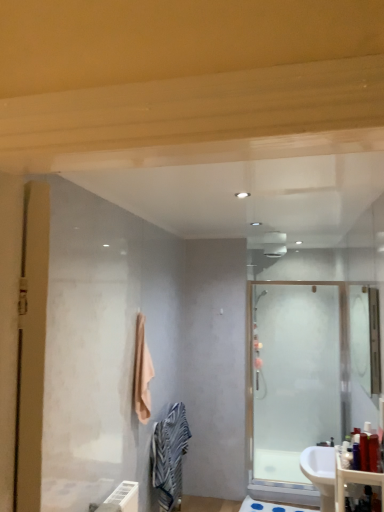
Question: Is matte plastic counter top at lower right facing away from translucent plastic bottle at lower right, the fourth toiletry from the left?

Choices:
 (A) no
 (B) yes

Answer: (A)

Question: Does matte plastic counter top at lower right have a larger size compared to translucent plastic bottle at lower right, the first toiletry viewed from the right?

Choices:
 (A) no
 (B) yes

Answer: (B)

Question: Does matte plastic counter top at lower right have a lesser height compared to translucent plastic bottle at lower right, the fourth toiletry from the left?

Choices:
 (A) no
 (B) yes

Answer: (A)

Question: Is matte plastic counter top at lower right positioned behind translucent plastic bottle at lower right, the fourth toiletry from the left?

Choices:
 (A) yes
 (B) no

Answer: (B)

Question: From a real-world perspective, is matte plastic counter top at lower right beneath translucent plastic bottle at lower right, the fourth toiletry from the left?

Choices:
 (A) no
 (B) yes

Answer: (B)

Question: Is point (362, 438) positioned closer to the camera than point (369, 472)?

Choices:
 (A) closer
 (B) farther

Answer: (B)

Question: Looking at their shapes, would you say translucent plastic bottle at right, which ranks as the 2th toiletry in right-to-left order, is wider or thinner than matte plastic counter top at lower right?

Choices:
 (A) wide
 (B) thin

Answer: (B)

Question: Relative to matte plastic counter top at lower right, is translucent plastic bottle at right, the third toiletry viewed from the left, in front or behind?

Choices:
 (A) front
 (B) behind

Answer: (B)

Question: Is translucent plastic bottle at right, which ranks as the 2th toiletry in right-to-left order, to the left or to the right of matte plastic counter top at lower right in the image?

Choices:
 (A) left
 (B) right

Answer: (A)

Question: Is point (360, 436) closer or farther from the camera than point (370, 456)?

Choices:
 (A) farther
 (B) closer

Answer: (A)

Question: From a real-world perspective, is translucent plastic bottle at right, the third toiletry viewed from the left, positioned above or below translucent plastic bottle at lower right, the first toiletry viewed from the right?

Choices:
 (A) above
 (B) below

Answer: (B)

Question: Is translucent plastic bottle at right, the third toiletry viewed from the left, in front of or behind translucent plastic bottle at lower right, the first toiletry viewed from the right, in the image?

Choices:
 (A) behind
 (B) front

Answer: (A)

Question: Would you say translucent plastic bottle at right, which ranks as the 2th toiletry in right-to-left order, is to the left or to the right of translucent plastic bottle at lower right, the first toiletry viewed from the right, in the picture?

Choices:
 (A) left
 (B) right

Answer: (A)

Question: From the image's perspective, is white glossy sink at lower right located above or below clear glass mirror at upper right?

Choices:
 (A) above
 (B) below

Answer: (B)

Question: Considering the positions of white glossy sink at lower right and clear glass mirror at upper right in the image, is white glossy sink at lower right wider or thinner than clear glass mirror at upper right?

Choices:
 (A) thin
 (B) wide

Answer: (B)